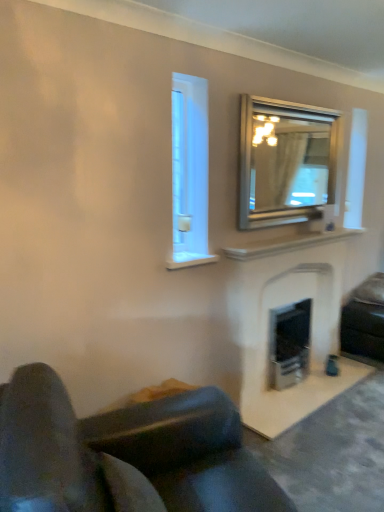
Question: Considering the positions of black leather studio couch at lower right, which is the 1th studio couch from back to front, and leather couch at lower left, the 1th studio couch when ordered from front to back, in the image, is black leather studio couch at lower right, which is the 1th studio couch from back to front, taller or shorter than leather couch at lower left, the 1th studio couch when ordered from front to back,?

Choices:
 (A) tall
 (B) short

Answer: (B)

Question: Considering the positions of point (350, 314) and point (56, 438), is point (350, 314) closer or farther from the camera than point (56, 438)?

Choices:
 (A) farther
 (B) closer

Answer: (A)

Question: Considering the real-world distances, which object is closest to the black leather studio couch at lower right, which is the 2th studio couch in front-to-back order?

Choices:
 (A) leather couch at lower left, positioned as the second studio couch in back-to-front order
 (B) silver metallic mirror at upper right
 (C) white marble fireplace at upper center
 (D) white stone fireplace at center

Answer: (D)

Question: Estimate the real-world distances between objects in this image. Which object is farther from the white marble fireplace at upper center?

Choices:
 (A) leather couch at lower left, acting as the first studio couch starting from the left
 (B) black leather studio couch at lower right, the second studio couch from the left
 (C) white stone fireplace at center
 (D) silver metallic mirror at upper right

Answer: (A)